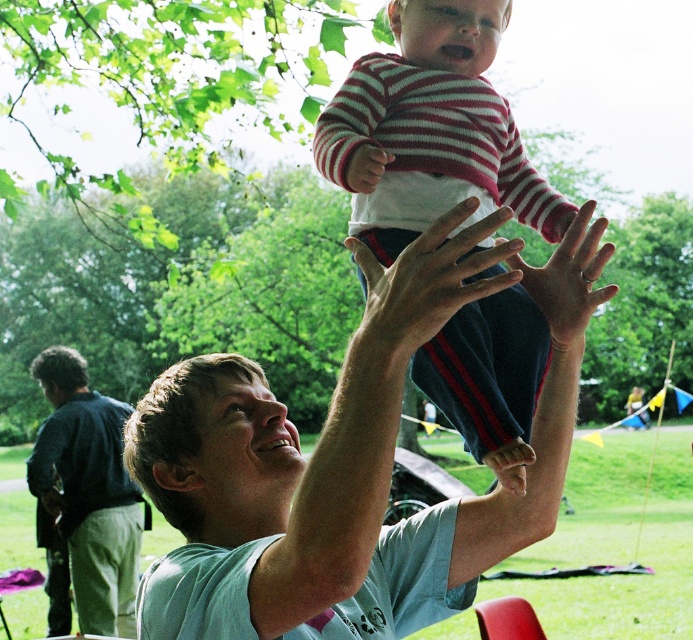
You are a photographer trying to capture the perfect shot of the striped cotton shirt at center and dark blue jeans at lower left. Since you want to ensure both are visible in the frame, which object should you focus on first to get both in focus?

The striped cotton shirt at center is located above dark blue jeans at lower left, so you should focus on the striped cotton shirt at center first to ensure both are in focus.